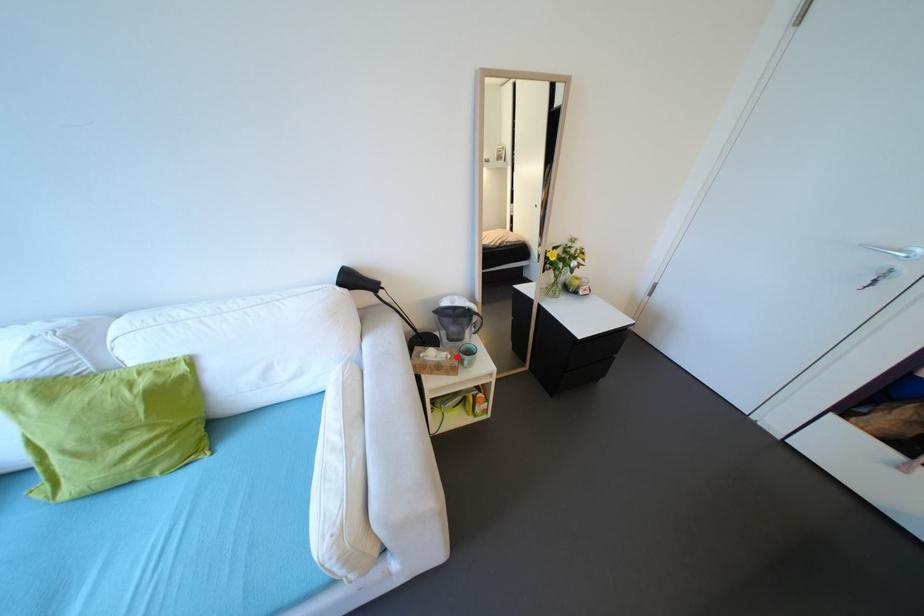
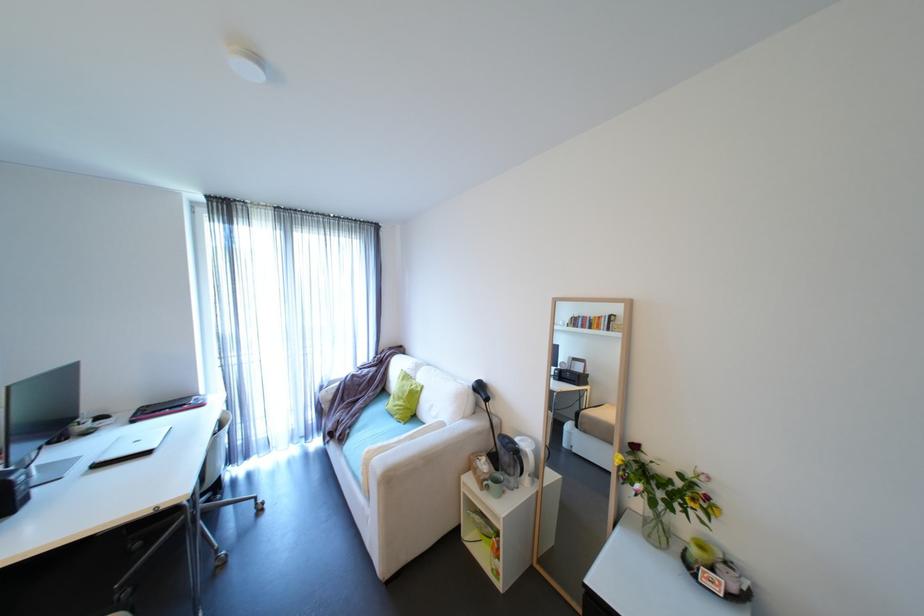
In the second image, find the point that corresponds to the highlighted location in the first image.

(492, 471)